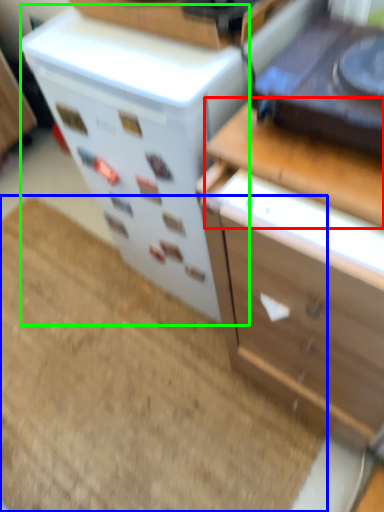
Question: Estimate the real-world distances between objects in this image. Which object is closer to counter top (highlighted by a red box), doormat (highlighted by a blue box) or appliance (highlighted by a green box)?

Choices:
 (A) doormat
 (B) appliance

Answer: (B)